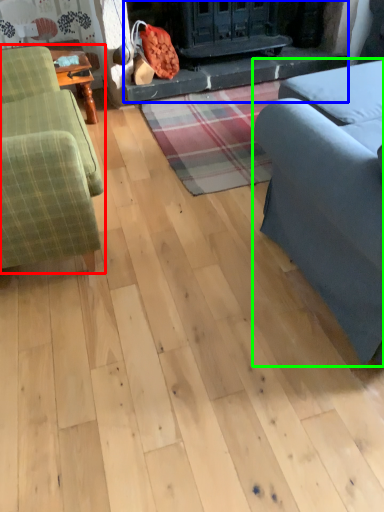
Question: Which object is the farthest from studio couch (highlighted by a red box)? Choose among these: fireplace (highlighted by a blue box) or studio couch (highlighted by a green box).

Choices:
 (A) fireplace
 (B) studio couch

Answer: (A)